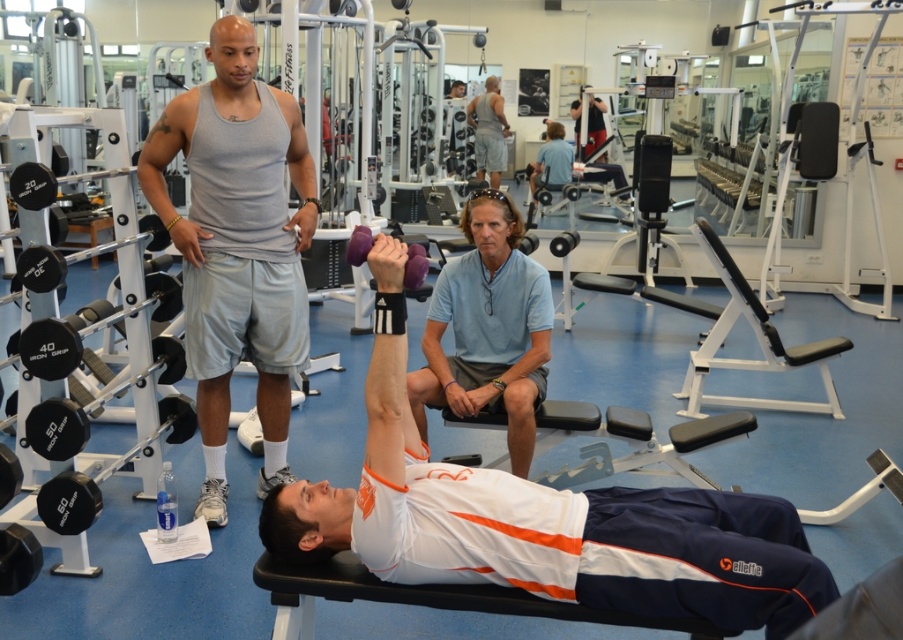
Question: Can you confirm if light blue cotton polo shirt at center is wider than matte black dumbbell at upper center?

Choices:
 (A) no
 (B) yes

Answer: (B)

Question: Which is nearer to the light blue cotton polo shirt at center?

Choices:
 (A) white matte dumbbell at center
 (B) gray cotton tank top at upper left
 (C) matte black dumbbell at upper center

Answer: (B)

Question: Is the position of white matte dumbbell at center less distant than that of gray cotton tank top at upper left?

Choices:
 (A) yes
 (B) no

Answer: (A)

Question: Does white matte dumbbell at center appear on the right side of matte gray tank top at upper center?

Choices:
 (A) yes
 (B) no

Answer: (B)

Question: Which object is farther from the camera taking this photo?

Choices:
 (A) gray cotton tank top at upper left
 (B) light blue cotton polo shirt at center
 (C) matte gray tank top at upper center
 (D) matte black dumbbell at upper center

Answer: (C)

Question: Based on their relative distances, which object is nearer to the light blue cotton polo shirt at center?

Choices:
 (A) white matte dumbbell at center
 (B) matte gray tank top at upper center
 (C) gray cotton tank top at upper left
 (D) matte black dumbbell at upper center

Answer: (C)